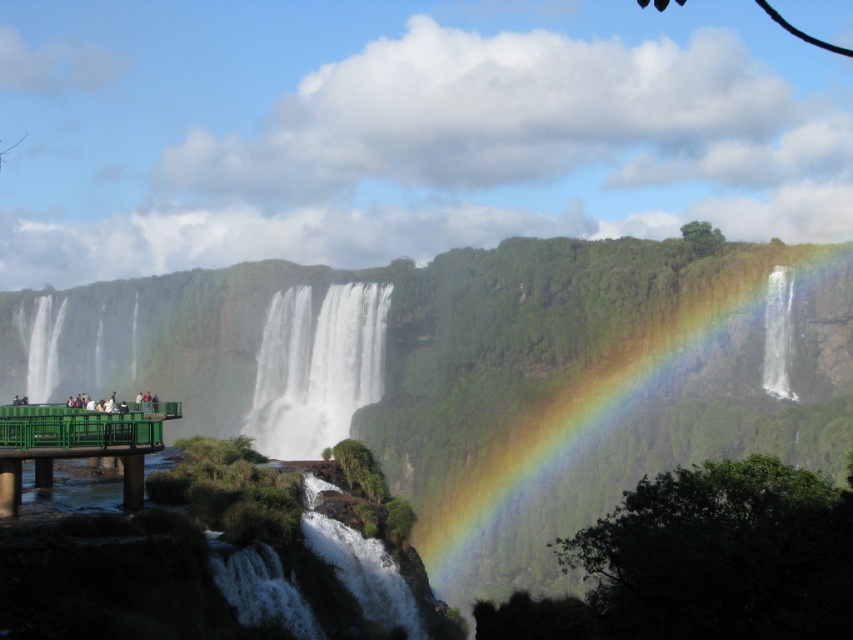
Between point (59, 442) and point (42, 365), which one is positioned in front?

Point (59, 442) is in front.

Is green metallic railing at lower left bigger than white smooth waterfall at left?

No, green metallic railing at lower left is not bigger than white smooth waterfall at left.

Who is more distant from viewer, (4,420) or (45,369)?

Point (45,369)

Find the location of a particular element. Image resolution: width=853 pixels, height=640 pixels. green metallic railing at lower left is located at coordinates (79, 432).

Which is more to the right, rainbow at center or white smooth waterfall at left?

Positioned to the right is rainbow at center.

Does rainbow at center lie behind white smooth waterfall at left?

No, it is in front of white smooth waterfall at left.

Find the location of a particular element. rainbow at center is located at coordinates (624, 394).

This screenshot has width=853, height=640. What do you see at coordinates (624, 394) in the screenshot? I see `rainbow at center` at bounding box center [624, 394].

Is rainbow at center taller than transparent glass waterfall at right?

Indeed, rainbow at center has a greater height compared to transparent glass waterfall at right.

Locate an element on the screen. The width and height of the screenshot is (853, 640). rainbow at center is located at coordinates (624, 394).

I want to click on rainbow at center, so click(624, 394).